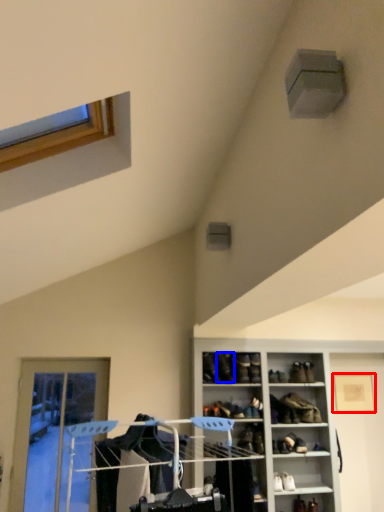
Question: Which of the following is the closest to the observer, picture frame (highlighted by a red box) or shoe (highlighted by a blue box)?

Choices:
 (A) picture frame
 (B) shoe

Answer: (B)